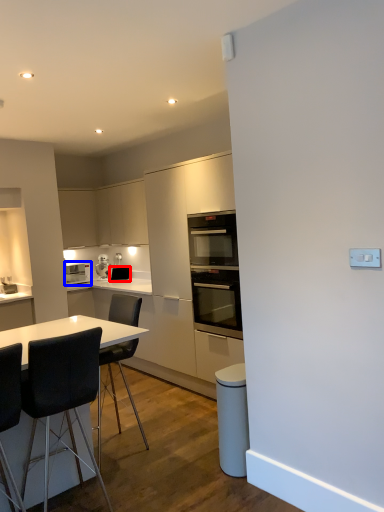
Question: Which object is closer to the camera taking this photo, appliance (highlighted by a red box) or home appliance (highlighted by a blue box)?

Choices:
 (A) appliance
 (B) home appliance

Answer: (B)